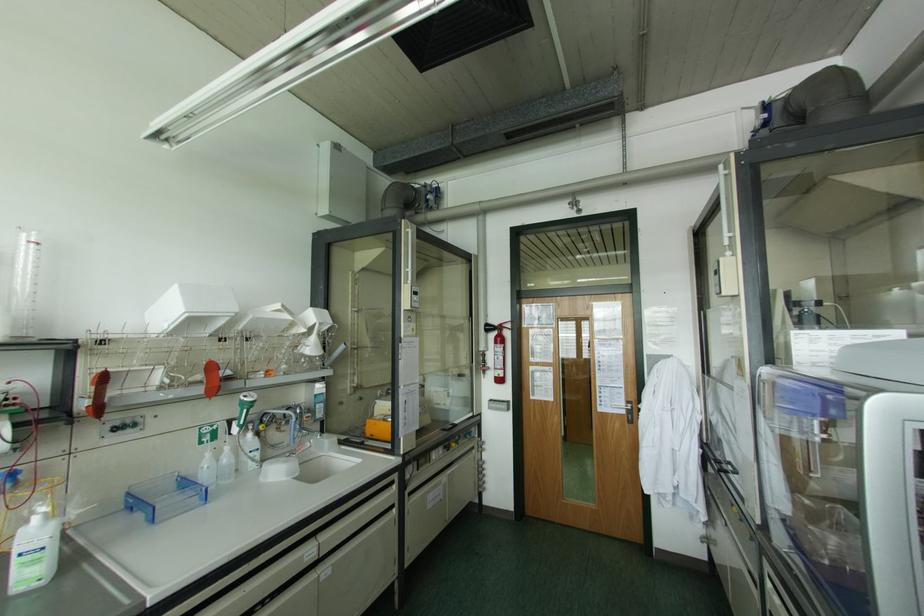
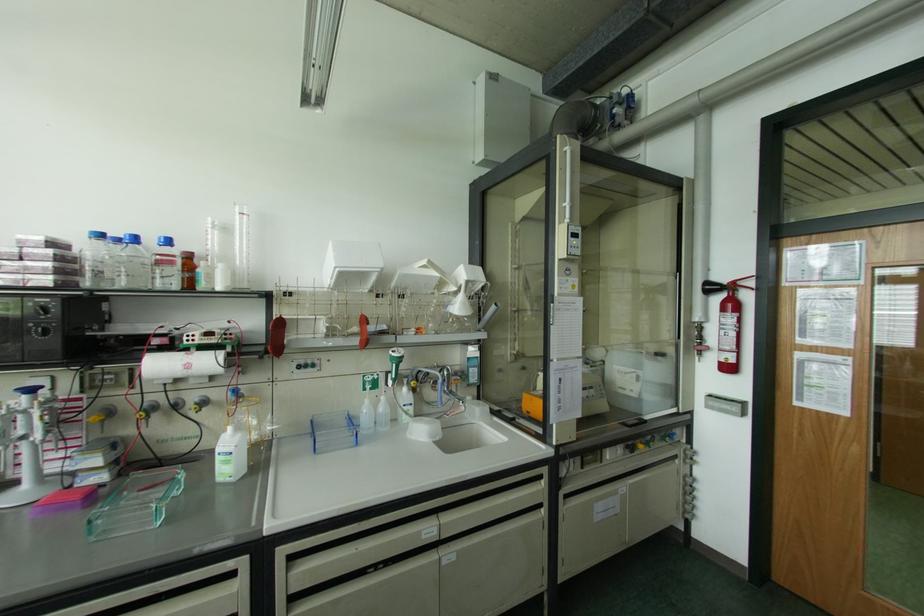
Find the pixel in the second image that matches pixel 226 448 in the first image.

(382, 398)